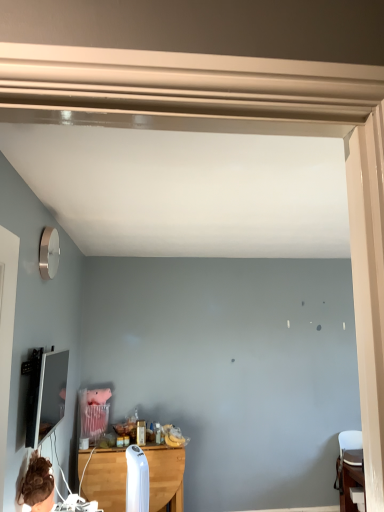
Question: Is wooden table at center, the second table when ordered from right to left, outside matte black tv at left?

Choices:
 (A) no
 (B) yes

Answer: (B)

Question: From a real-world perspective, is wooden table at center, the second table when ordered from right to left, under matte black tv at left?

Choices:
 (A) no
 (B) yes

Answer: (B)

Question: From a real-world perspective, is wooden table at center, the second table when ordered from right to left, physically above matte black tv at left?

Choices:
 (A) no
 (B) yes

Answer: (A)

Question: From the image's perspective, does wooden table at center, the second table when ordered from right to left, appear lower than matte black tv at left?

Choices:
 (A) yes
 (B) no

Answer: (A)

Question: Is there a large distance between wooden table at center, the first table in the left-to-right sequence, and matte black tv at left?

Choices:
 (A) yes
 (B) no

Answer: (A)

Question: Is wooden table at center, the first table in the left-to-right sequence, to the left or to the right of wooden table at lower right, positioned as the 1th table in right-to-left order, in the image?

Choices:
 (A) right
 (B) left

Answer: (B)

Question: Does point (86, 484) appear closer or farther from the camera than point (359, 453)?

Choices:
 (A) farther
 (B) closer

Answer: (B)

Question: Looking at the image, does wooden table at center, the first table in the left-to-right sequence, seem bigger or smaller compared to wooden table at lower right, positioned as the 1th table in right-to-left order?

Choices:
 (A) small
 (B) big

Answer: (B)

Question: From a real-world perspective, relative to wooden table at lower right, which appears as the second table when viewed from the left, is wooden table at center, the second table when ordered from right to left, vertically above or below?

Choices:
 (A) above
 (B) below

Answer: (A)

Question: Considering the positions of wooden table at lower right, positioned as the 1th table in right-to-left order, and wooden table at center, the second table when ordered from right to left, in the image, is wooden table at lower right, positioned as the 1th table in right-to-left order, wider or thinner than wooden table at center, the second table when ordered from right to left,?

Choices:
 (A) thin
 (B) wide

Answer: (B)

Question: In the image, is wooden table at lower right, which appears as the second table when viewed from the left, positioned in front of or behind wooden table at center, the first table in the left-to-right sequence?

Choices:
 (A) front
 (B) behind

Answer: (B)

Question: Is wooden table at lower right, which appears as the second table when viewed from the left, inside the boundaries of wooden table at center, the second table when ordered from right to left, or outside?

Choices:
 (A) inside
 (B) outside

Answer: (B)

Question: From a real-world perspective, is wooden table at lower right, which appears as the second table when viewed from the left, positioned above or below wooden table at center, the first table in the left-to-right sequence?

Choices:
 (A) below
 (B) above

Answer: (A)

Question: Considering the positions of matte black tv at left and wooden table at lower right, positioned as the 1th table in right-to-left order, in the image, is matte black tv at left taller or shorter than wooden table at lower right, positioned as the 1th table in right-to-left order,?

Choices:
 (A) short
 (B) tall

Answer: (A)

Question: In the image, is matte black tv at left positioned in front of or behind wooden table at lower right, which appears as the second table when viewed from the left?

Choices:
 (A) front
 (B) behind

Answer: (A)